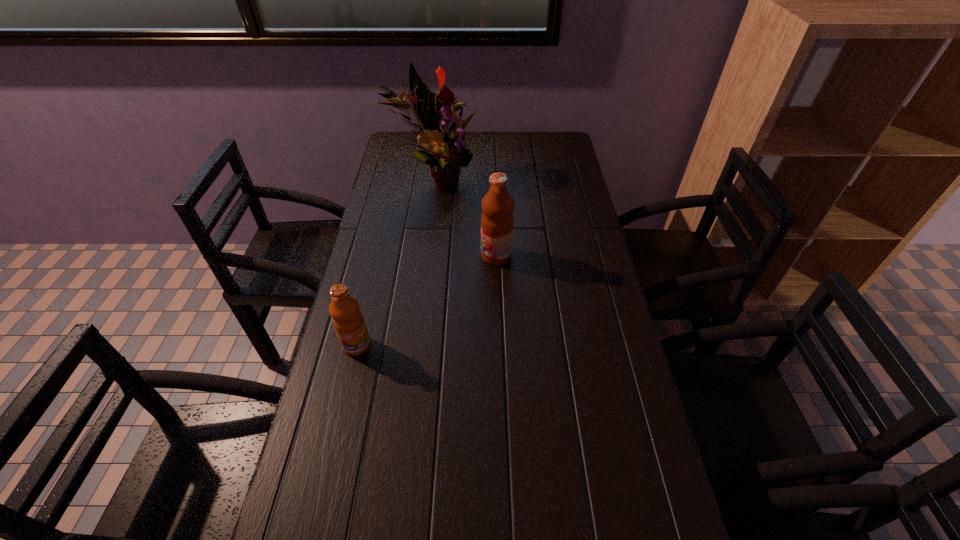
The height and width of the screenshot is (540, 960). In order to click on free spot located on the label side of the nearer fruit juice in this screenshot , I will do `click(330, 457)`.

Locate an element on the screen. The image size is (960, 540). object at the far edge is located at coordinates (448, 154).

Where is `bouquet that is positioned at the left edge`? The height and width of the screenshot is (540, 960). bouquet that is positioned at the left edge is located at coordinates (448, 154).

The height and width of the screenshot is (540, 960). In order to click on fruit juice that is positioned at the left edge in this screenshot , I will do `click(348, 321)`.

Locate an element on the screen. This screenshot has width=960, height=540. object that is at the far left corner is located at coordinates (448, 154).

Identify the location of vacant space at the far edge. (520, 148).

At what (x,y) coordinates should I click in order to perform the action: click on vacant space at the left edge. Please return your answer as a coordinate pair (x, y). Looking at the image, I should click on (412, 186).

This screenshot has height=540, width=960. Find the location of `vacant space at the right edge`. vacant space at the right edge is located at coordinates (583, 194).

At what (x,y) coordinates should I click in order to perform the action: click on vacant area at the far left corner of the desktop. Please return your answer as a coordinate pair (x, y). Looking at the image, I should click on (400, 159).

The width and height of the screenshot is (960, 540). Identify the location of free area in between the farthest object and the left fruit juice. (396, 264).